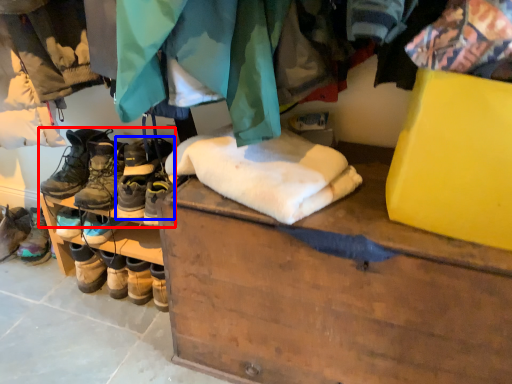
Question: Among these objects, which one is nearest to the camera, footwear (highlighted by a red box) or footwear (highlighted by a blue box)?

Choices:
 (A) footwear
 (B) footwear

Answer: (A)